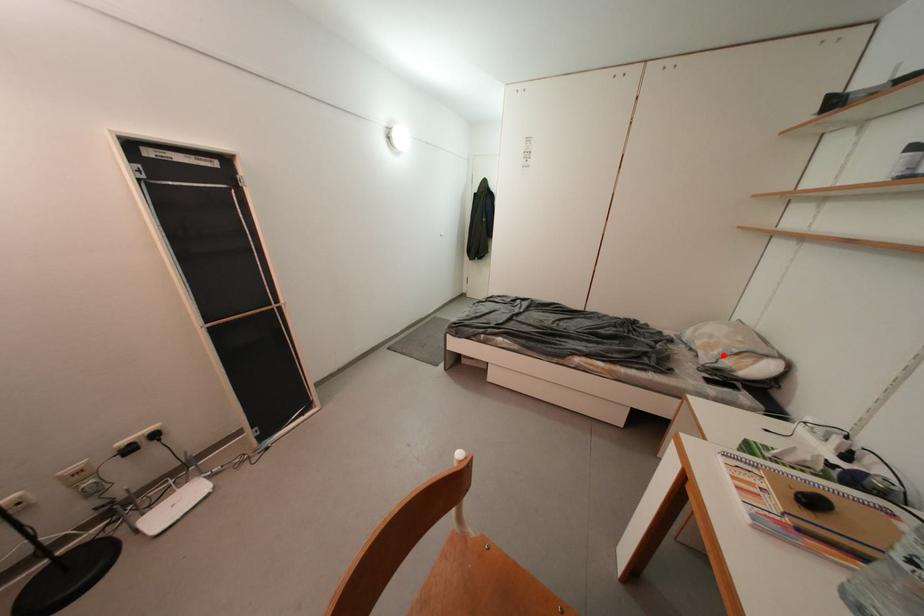
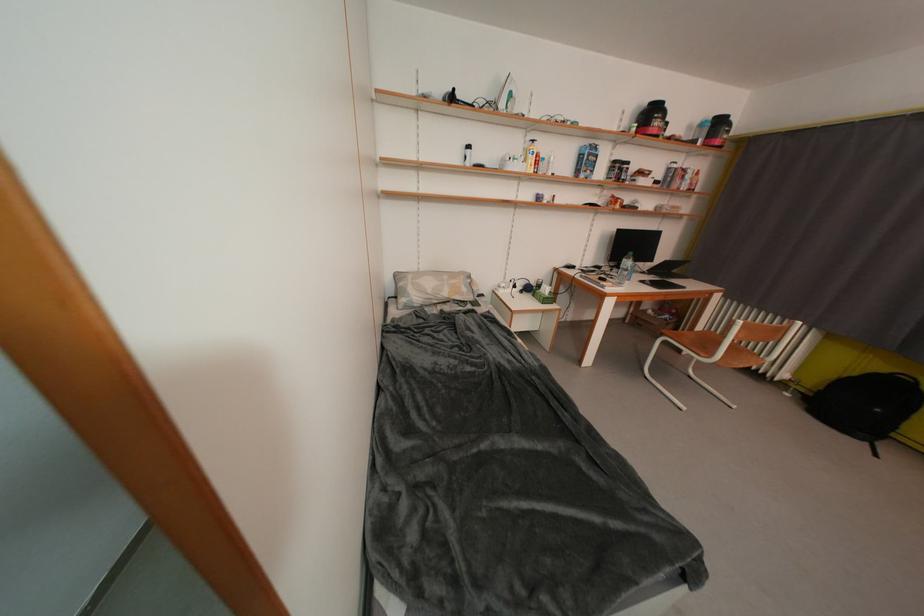
In the second image, find the point that corresponds to the highlighted location in the first image.

(471, 293)